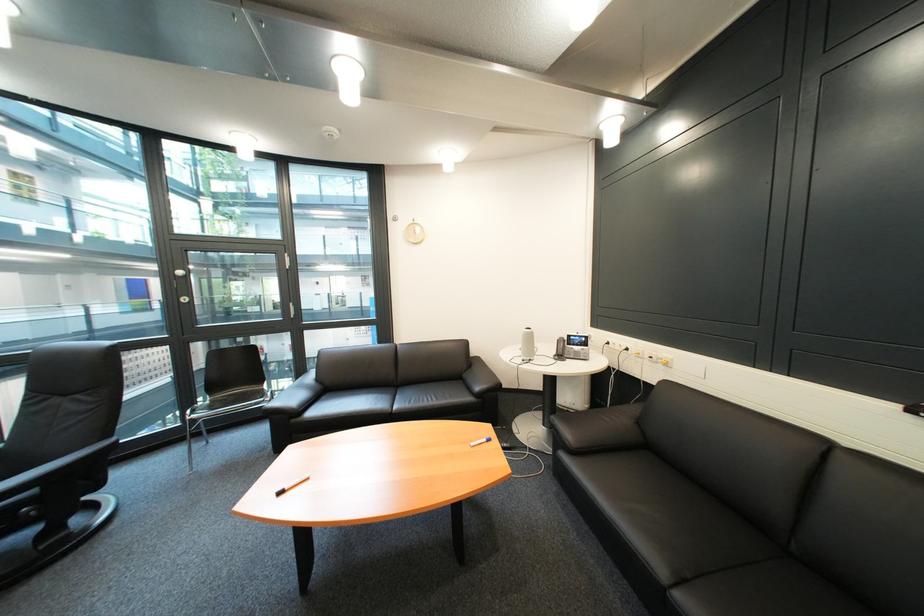
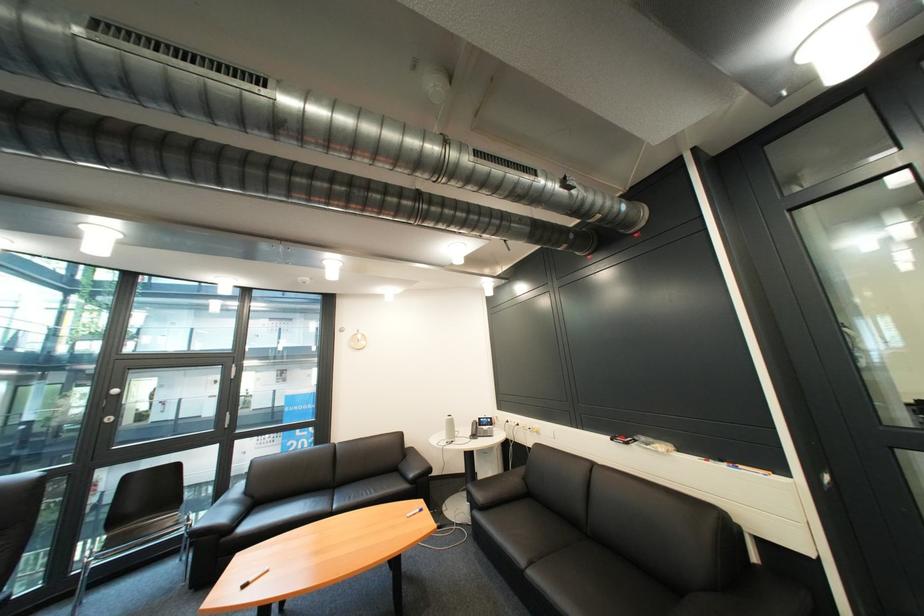
The point at (640, 351) is marked in the first image. Where is the corresponding point in the second image?

(531, 426)